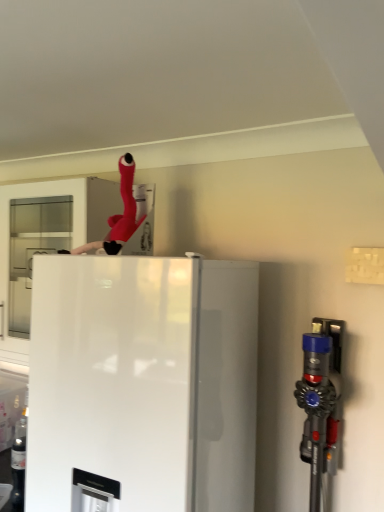
Question: Is rubberized red hose at upper center in front of or behind blue plastic vacuum cleaner at right in the image?

Choices:
 (A) front
 (B) behind

Answer: (B)

Question: In terms of size, does rubberized red hose at upper center appear bigger or smaller than blue plastic vacuum cleaner at right?

Choices:
 (A) big
 (B) small

Answer: (B)

Question: Which of these objects is positioned closest to the blue plastic vacuum cleaner at right?

Choices:
 (A) rubberized red hose at upper center
 (B) white glossy refrigerator at center

Answer: (B)

Question: Which object is positioned closest to the rubberized red hose at upper center?

Choices:
 (A) white glossy refrigerator at center
 (B) blue plastic vacuum cleaner at right

Answer: (A)